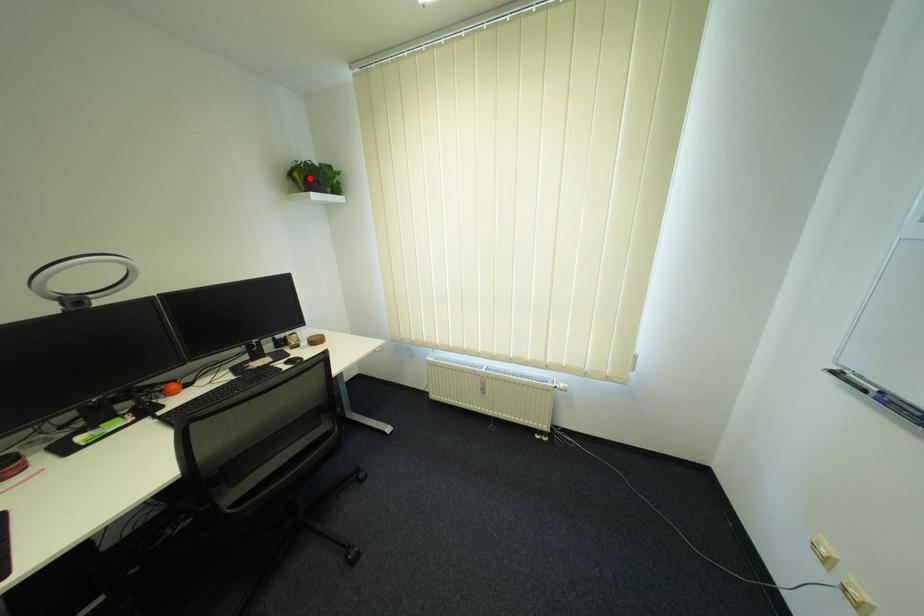
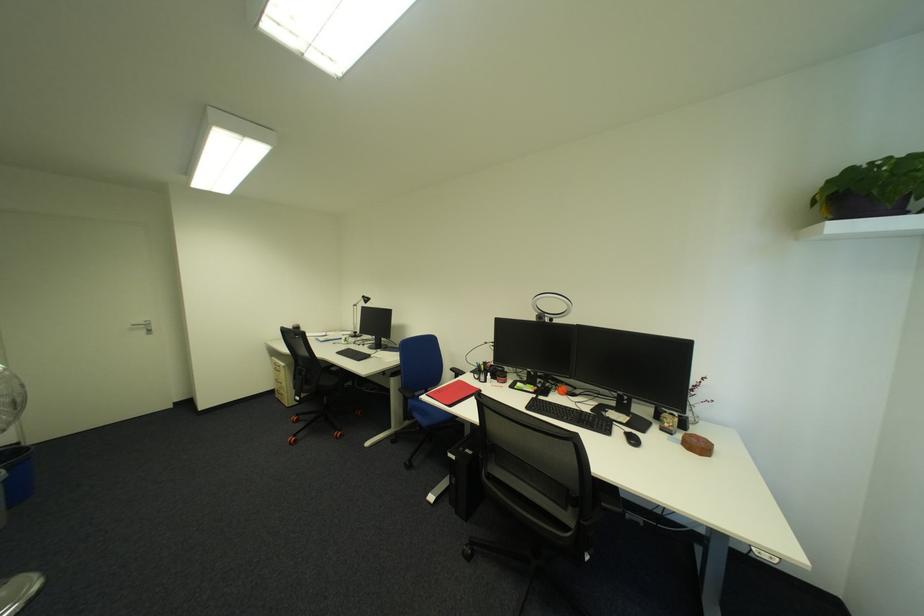
Question: I am providing you with two images of the same scene from different viewpoints. A red point is marked on the first image. At the location where the point appears in image 1, is it still visible in image 2?

Choices:
 (A) Yes
 (B) No

Answer: (A)